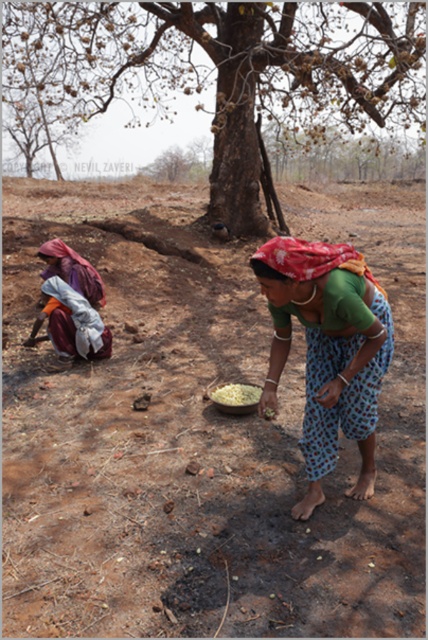
Does point (374, 10) come farther from viewer compared to point (359, 374)?

Yes.

Does brown rough tree at center appear on the left side of green fabric cloth at center?

Indeed, brown rough tree at center is positioned on the left side of green fabric cloth at center.

Between point (252, 38) and point (336, 298), which one is positioned behind?

The point (252, 38) is behind.

Where is `brown rough tree at center`? The image size is (428, 640). brown rough tree at center is located at coordinates (222, 70).

Does brown soil at center appear over brown rough tree at center?

Incorrect, brown soil at center is not positioned above brown rough tree at center.

Can you confirm if brown soil at center is taller than brown rough tree at center?

In fact, brown soil at center may be shorter than brown rough tree at center.

Find the location of a particular element. This screenshot has width=428, height=640. brown soil at center is located at coordinates (199, 432).

Identify the location of green fabric cloth at center. This screenshot has height=640, width=428. (327, 349).

Can you confirm if green fabric cloth at center is thinner than yellow grain at center?

No, green fabric cloth at center is not thinner than yellow grain at center.

Describe the element at coordinates (327, 349) in the screenshot. I see `green fabric cloth at center` at that location.

You are a GUI agent. You are given a task and a screenshot of the screen. Output one action in this format:
    pyautogui.click(x=<x>, y=<y>)
    Task: Click on the green fabric cloth at center
    
    Given the screenshot: What is the action you would take?
    pyautogui.click(x=327, y=349)